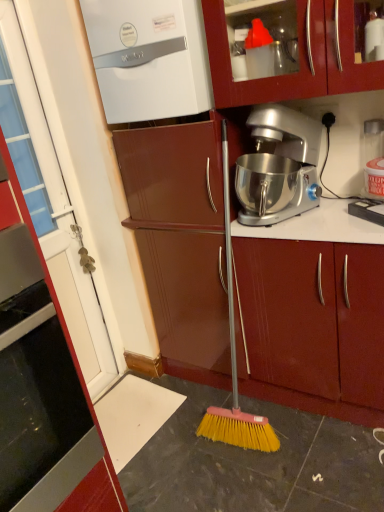
Question: Considering the relative positions of matte wood cabinet at center, the second cabinetry from the front, and white glossy door at left, the first cabinetry when ordered from front to back, in the image provided, is matte wood cabinet at center, the second cabinetry from the front, to the right of white glossy door at left, the first cabinetry when ordered from front to back, from the viewer's perspective?

Choices:
 (A) no
 (B) yes

Answer: (B)

Question: Does matte wood cabinet at center, the second cabinetry from the front, come behind white glossy door at left, placed as the second cabinetry when sorted from back to front?

Choices:
 (A) no
 (B) yes

Answer: (B)

Question: Is matte wood cabinet at center, placed as the 1th cabinetry when sorted from back to front, positioned in front of white glossy door at left, arranged as the 1th cabinetry when viewed from the left?

Choices:
 (A) yes
 (B) no

Answer: (B)

Question: From the image's perspective, does matte wood cabinet at center, the second cabinetry from the front, appear higher than white glossy door at left, the first cabinetry when ordered from front to back?

Choices:
 (A) no
 (B) yes

Answer: (A)

Question: Can white glossy door at left, which is the 2th cabinetry in right-to-left order, be found inside matte wood cabinet at center, which ranks as the 2th cabinetry in left-to-right order?

Choices:
 (A) yes
 (B) no

Answer: (B)

Question: Considering the positions of white glossy boiler at upper left and white glossy door at left, the first cabinetry when ordered from front to back, in the image, is white glossy boiler at upper left bigger or smaller than white glossy door at left, the first cabinetry when ordered from front to back,?

Choices:
 (A) small
 (B) big

Answer: (B)

Question: From a real-world perspective, is white glossy boiler at upper left positioned above or below white glossy door at left, which is the 2th cabinetry in right-to-left order?

Choices:
 (A) below
 (B) above

Answer: (B)

Question: Relative to white glossy door at left, which is the 2th cabinetry in right-to-left order, is white glossy boiler at upper left in front or behind?

Choices:
 (A) behind
 (B) front

Answer: (A)

Question: Looking at their shapes, would you say white glossy boiler at upper left is wider or thinner than white glossy door at left, the first cabinetry when ordered from front to back?

Choices:
 (A) wide
 (B) thin

Answer: (B)

Question: Is silver metallic stand mixer at center taller or shorter than matte wood cabinet at center, which ranks as the 2th cabinetry in left-to-right order?

Choices:
 (A) short
 (B) tall

Answer: (A)

Question: Is point (276, 150) closer or farther from the camera than point (337, 332)?

Choices:
 (A) closer
 (B) farther

Answer: (B)

Question: In terms of size, does silver metallic stand mixer at center appear bigger or smaller than matte wood cabinet at center, the first cabinetry in the right-to-left sequence?

Choices:
 (A) small
 (B) big

Answer: (A)

Question: Considering the relative positions of silver metallic stand mixer at center and matte wood cabinet at center, placed as the 1th cabinetry when sorted from back to front, in the image provided, is silver metallic stand mixer at center to the left or to the right of matte wood cabinet at center, placed as the 1th cabinetry when sorted from back to front,?

Choices:
 (A) right
 (B) left

Answer: (B)

Question: From their relative heights in the image, would you say white glossy door at left, which is the 2th cabinetry in right-to-left order, is taller or shorter than white glossy boiler at upper left?

Choices:
 (A) tall
 (B) short

Answer: (A)

Question: Based on their positions, is white glossy door at left, placed as the second cabinetry when sorted from back to front, located to the left or right of white glossy boiler at upper left?

Choices:
 (A) right
 (B) left

Answer: (B)